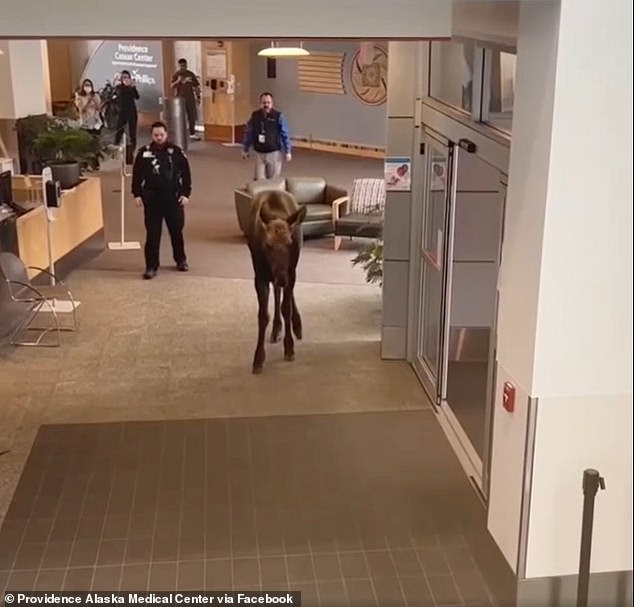
Where is `green leafed plant`? green leafed plant is located at coordinates (66, 146).